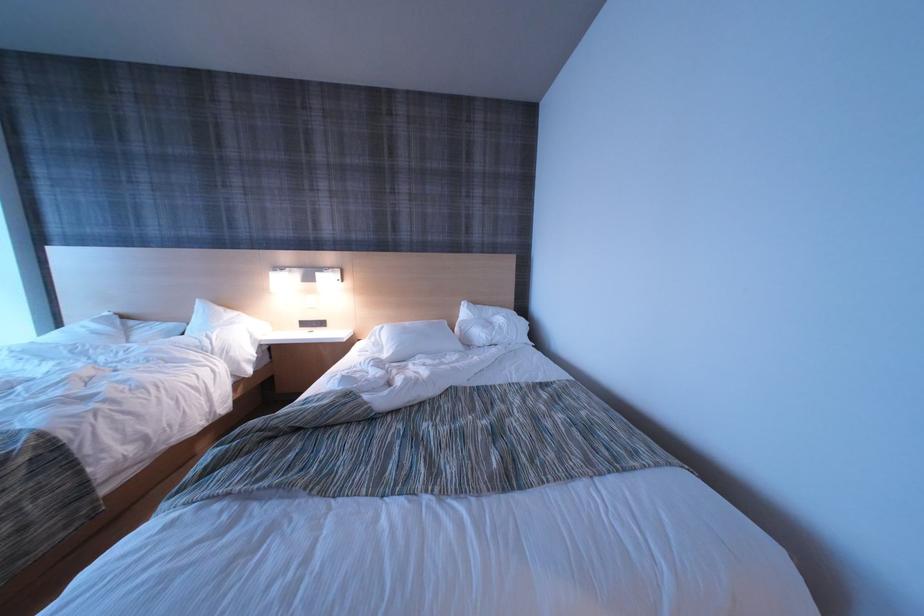
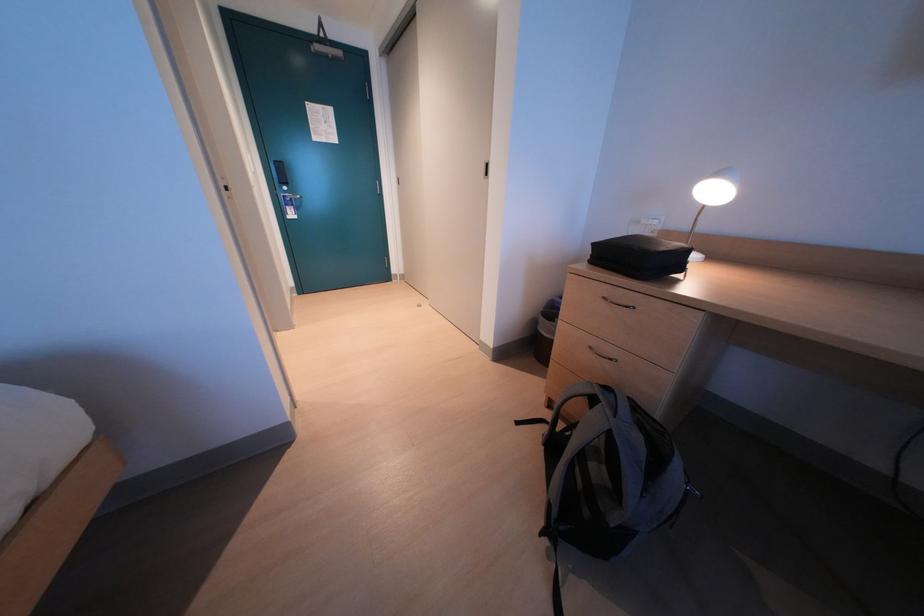
Based on the continuous images, in which direction is the camera rotating?

The camera's rotation is toward right-down.